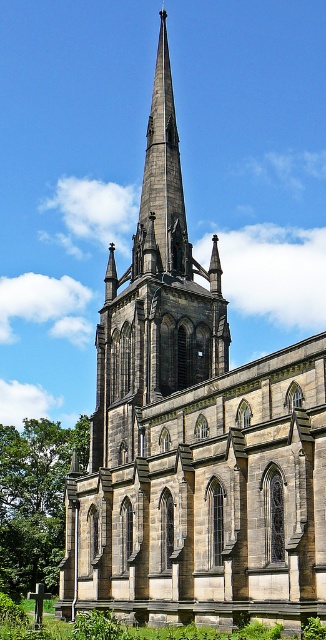
Question: Which point is closer to the camera?

Choices:
 (A) (10, 579)
 (B) (157, 237)

Answer: (B)

Question: Does green leafy tree at left appear over dark gray stone spire at center?

Choices:
 (A) yes
 (B) no

Answer: (B)

Question: Does green leafy tree at left appear on the left side of dark gray stone spire at center?

Choices:
 (A) no
 (B) yes

Answer: (B)

Question: Does green leafy tree at left appear under dark gray stone spire at center?

Choices:
 (A) no
 (B) yes

Answer: (B)

Question: Which of the following is the farthest from the observer?

Choices:
 (A) dark gray stone spire at center
 (B) green leafy tree at left

Answer: (B)